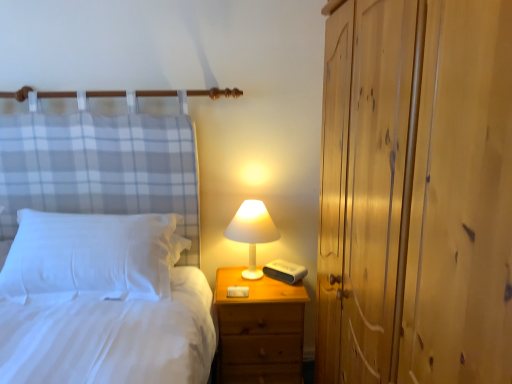
Question: Is white matte table lamp at upper right at the back of wooden nightstand at right?

Choices:
 (A) yes
 (B) no

Answer: (B)

Question: Does wooden nightstand at right have a greater width compared to white matte table lamp at upper right?

Choices:
 (A) no
 (B) yes

Answer: (B)

Question: From a real-world perspective, is wooden nightstand at right over white matte table lamp at upper right?

Choices:
 (A) no
 (B) yes

Answer: (A)

Question: From the image's perspective, does wooden nightstand at right appear higher than white matte table lamp at upper right?

Choices:
 (A) yes
 (B) no

Answer: (B)

Question: Does wooden nightstand at right turn towards white matte table lamp at upper right?

Choices:
 (A) no
 (B) yes

Answer: (A)

Question: Considering the relative positions of wooden nightstand at right and white matte table lamp at upper right in the image provided, is wooden nightstand at right to the left of white matte table lamp at upper right from the viewer's perspective?

Choices:
 (A) no
 (B) yes

Answer: (A)

Question: Would you say white soft pillow at left is a long distance from wooden nightstand at right?

Choices:
 (A) no
 (B) yes

Answer: (A)

Question: Is white soft pillow at left at the right side of wooden nightstand at right?

Choices:
 (A) yes
 (B) no

Answer: (B)

Question: Does white soft pillow at left have a larger size compared to wooden nightstand at right?

Choices:
 (A) yes
 (B) no

Answer: (B)

Question: Could you tell me if white soft pillow at left is facing wooden nightstand at right?

Choices:
 (A) yes
 (B) no

Answer: (B)

Question: Can you confirm if white soft pillow at left is thinner than wooden nightstand at right?

Choices:
 (A) yes
 (B) no

Answer: (A)

Question: Is white soft pillow at left taller than wooden nightstand at right?

Choices:
 (A) yes
 (B) no

Answer: (B)

Question: Are wooden nightstand at right and white soft pillow at left far apart?

Choices:
 (A) no
 (B) yes

Answer: (A)